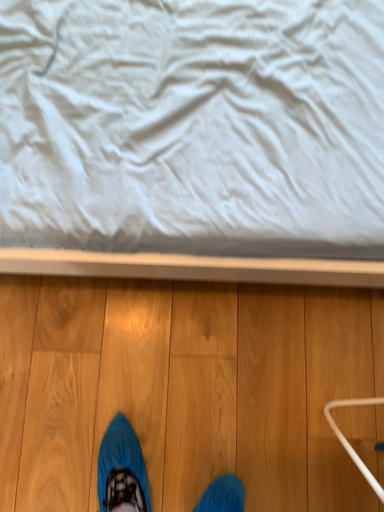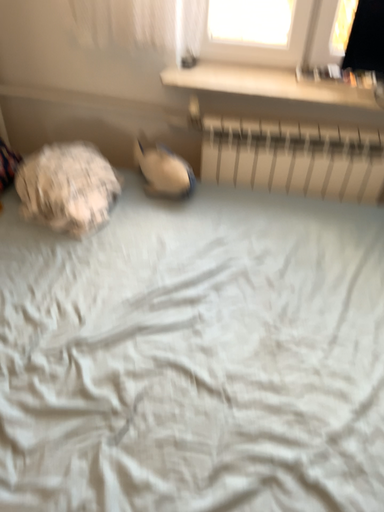
Question: Which way did the camera rotate in the video?

Choices:
 (A) rotated downward
 (B) rotated upward

Answer: (B)